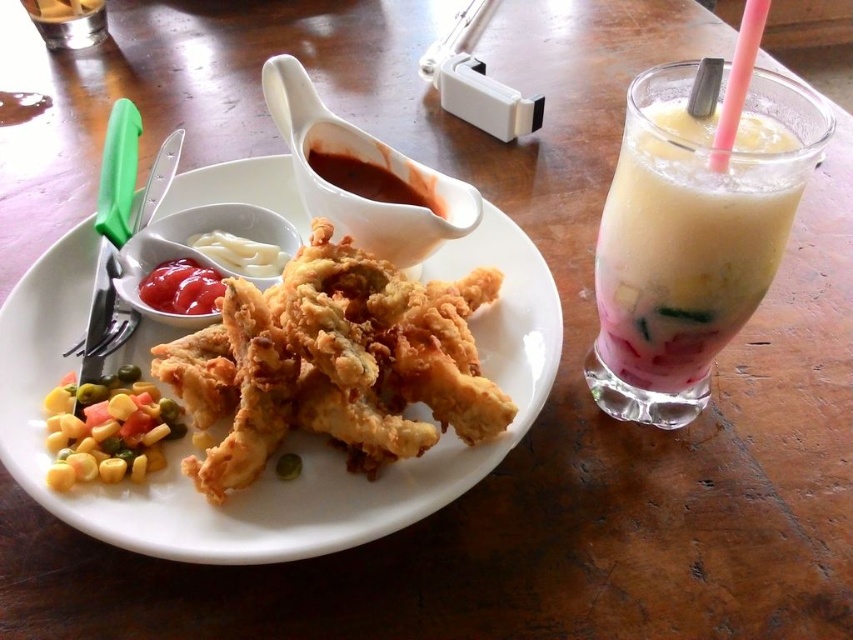
You are a food delivery person who needs to pack the items shown in the image. You have a box that can only fit one large item. Which item should you choose between the milky smooth drink at right and the translucent glass at upper left?

The milky smooth drink at right is bigger than the translucent glass at upper left, so you should choose the milky smooth drink at right to fit into the box.

You are at a restaurant table and want to grab the closest beverage to you. Which one should you choose between the milky smooth drink at right and the matte red ketchup at upper left?

The milky smooth drink at right is closer to the viewer than the matte red ketchup at upper left, so you should choose the milky smooth drink at right.